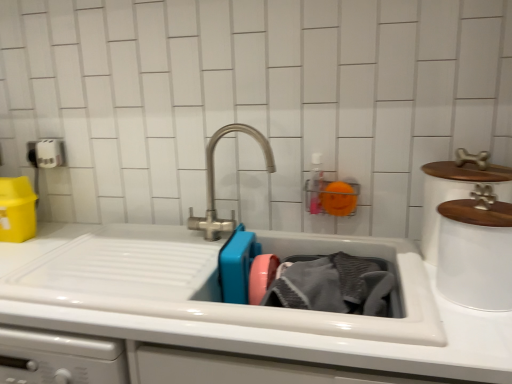
Question: In terms of size, does gray textured towel at sink appear bigger or smaller than white matte toilet paper at upper left?

Choices:
 (A) big
 (B) small

Answer: (A)

Question: Considering their positions, is gray textured towel at sink located in front of or behind white matte toilet paper at upper left?

Choices:
 (A) behind
 (B) front

Answer: (B)

Question: Which of these objects is positioned closest to the white glossy sink at center?

Choices:
 (A) satin nickel faucet at center
 (B) white ceramic container at upper right, the 1th appliance from the back
 (C) white matte pet food container at upper right, which is counted as the 1th appliance, starting from the front
 (D) white matte toilet paper at upper left
 (E) gray textured towel at sink

Answer: (E)

Question: Estimate the real-world distances between objects in this image. Which object is farther from the satin nickel faucet at center?

Choices:
 (A) white matte toilet paper at upper left
 (B) white ceramic container at upper right, the 1th appliance from the back
 (C) gray textured towel at sink
 (D) white glossy sink at center
 (E) white matte pet food container at upper right, which is counted as the 1th appliance, starting from the front

Answer: (A)